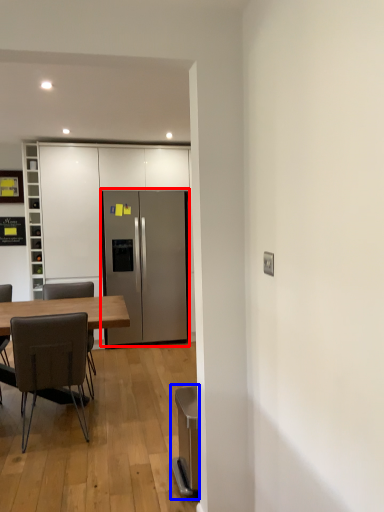
Question: Among these objects, which one is nearest to the camera, refrigerator (highlighted by a red box) or appliance (highlighted by a blue box)?

Choices:
 (A) refrigerator
 (B) appliance

Answer: (B)